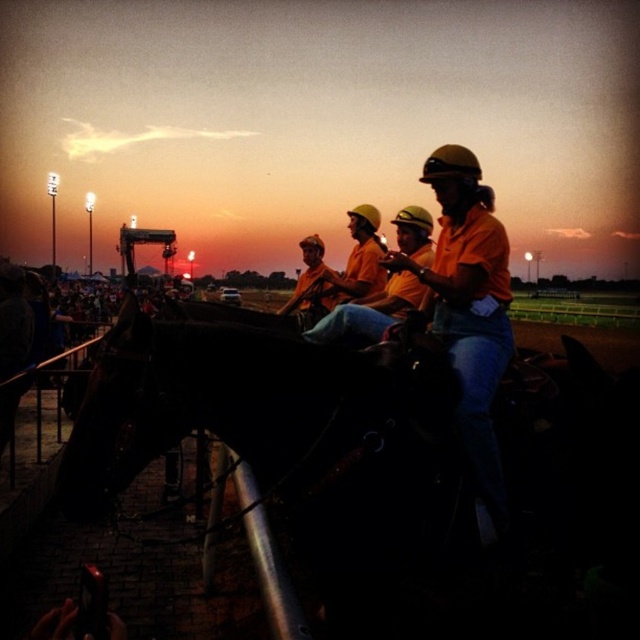
You are a photographer at the horse racing event. You want to take a photo that includes both the orange cotton shirt at center and the orange hard hat at center. Which object should you focus on first to ensure both are in frame?

The orange cotton shirt at center is much taller than the orange hard hat at center, so you should focus on the orange cotton shirt at center first to ensure both are in frame.